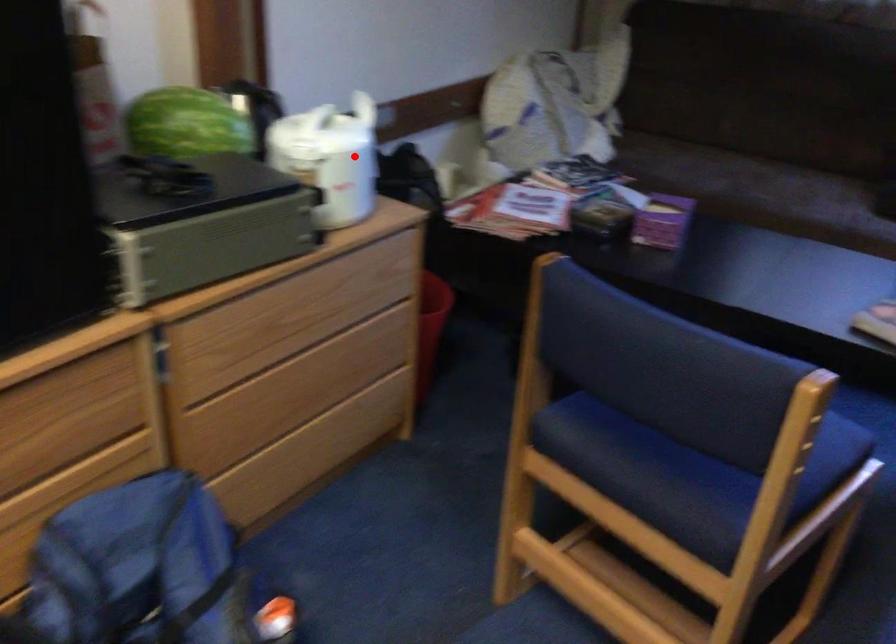
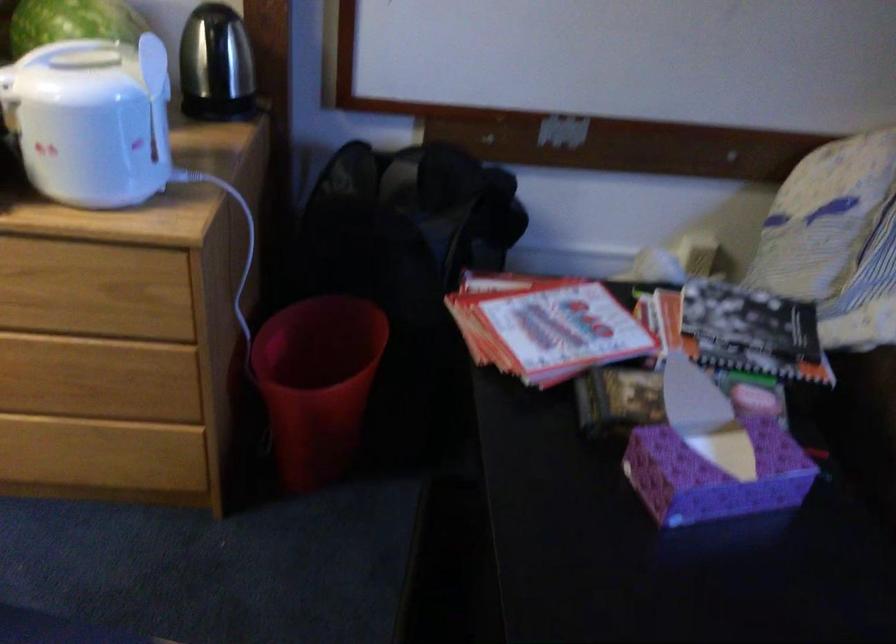
Locate, in the second image, the point that corresponds to the highlighted location in the first image.

(91, 120)